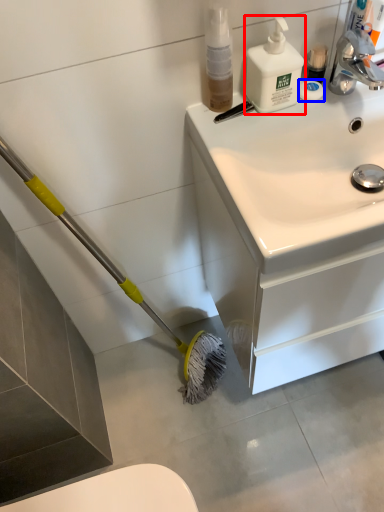
Question: Among these objects, which one is nearest to the camera, cleaning product (highlighted by a red box) or soap (highlighted by a blue box)?

Choices:
 (A) cleaning product
 (B) soap

Answer: (A)